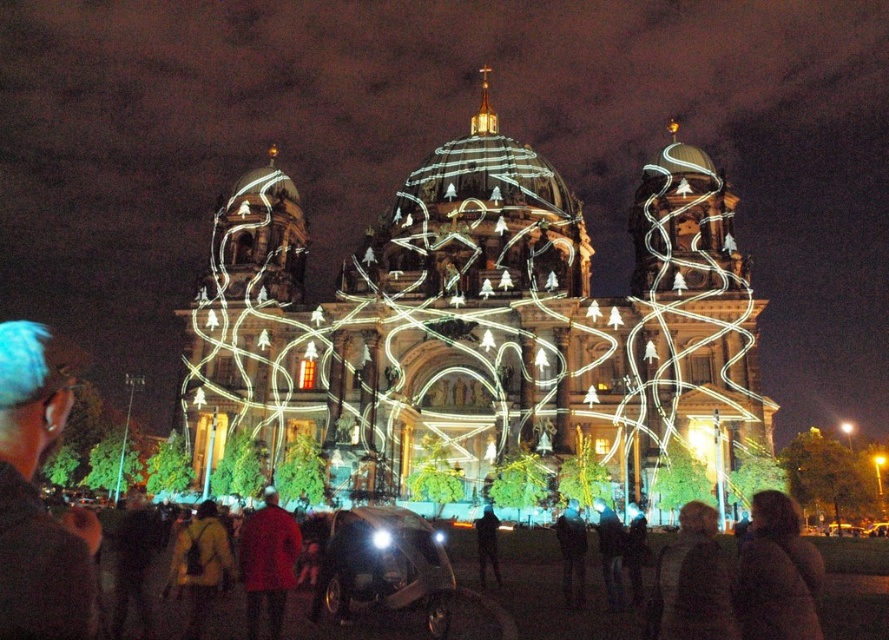
You are standing in the crowd at the cathedral lights. You see a person with blue hair at left and another wearing a dark blue fabric jacket at center. Which object is higher in the image?

The blue hair at left is positioned over dark blue fabric jacket at center, so it is higher in the image.

You are standing in front of the cathedral watching the light show. You want to take a photo of the red matte coat at center without including any people in the background. Is the distance sufficient to blur them out using a standard smartphone camera?

The red matte coat at center is 45.51 meters away from the viewer. At this distance, a standard smartphone camera should easily blur the background people due to the shallow depth of field effect at such a long focal length.

You are standing at the base of the cathedral and want to hand a scarf to a person with blue hair at left and another person wearing a dark blue fabric jacket at center. If you can only walk 30 meters, can you reach both people without exceeding your walking limit?

The blue hair at left and dark blue fabric jacket at center are 31.09 meters apart, so you cannot reach both within the 30 meters limit.